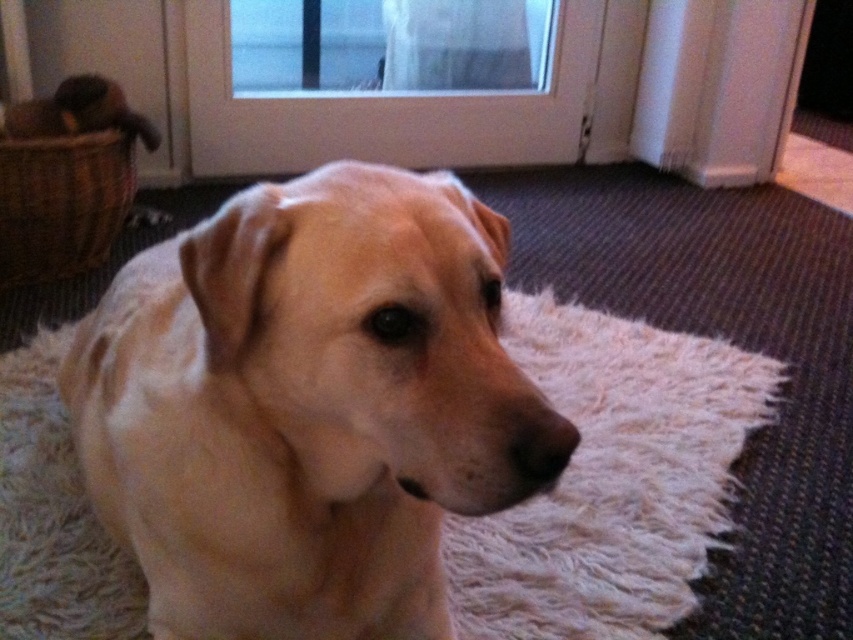
Question: Is transparent glass door at upper center behind woven brown basket at left?

Choices:
 (A) yes
 (B) no

Answer: (A)

Question: Which of the following is the farthest from the observer?

Choices:
 (A) light beige fur dog at center
 (B) transparent glass door at upper center

Answer: (B)

Question: Is light beige fur dog at center further to the viewer compared to transparent glass door at upper center?

Choices:
 (A) no
 (B) yes

Answer: (A)

Question: Which object is farther from the camera taking this photo?

Choices:
 (A) woven brown basket at left
 (B) light beige fur dog at center
 (C) transparent glass door at upper center
 (D) white glass screen door at upper center

Answer: (C)

Question: Among these objects, which one is farthest from the camera?

Choices:
 (A) light beige fur dog at center
 (B) transparent glass door at upper center
 (C) white glass screen door at upper center
 (D) woven brown basket at left

Answer: (B)

Question: Can you confirm if light beige fur dog at center is smaller than white glass screen door at upper center?

Choices:
 (A) no
 (B) yes

Answer: (B)